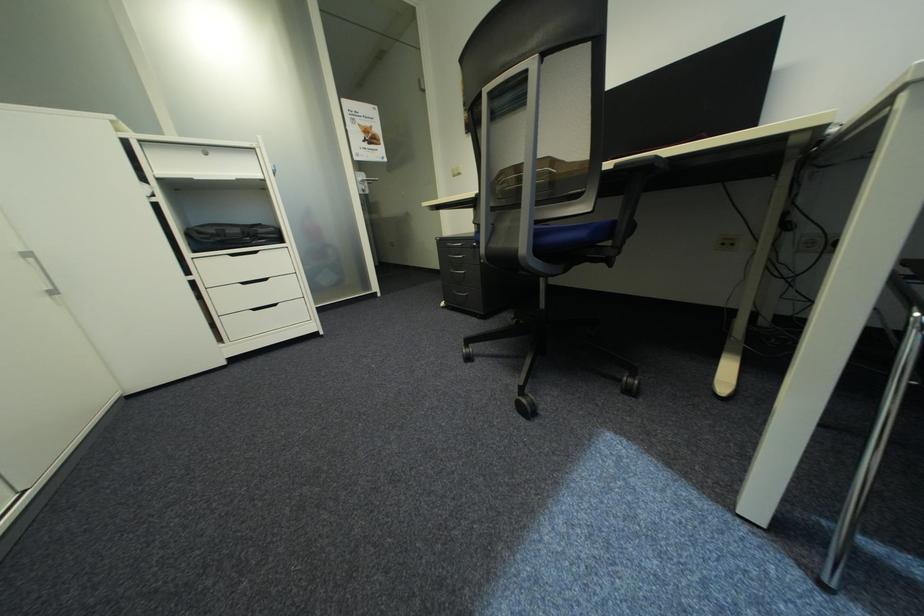
Where is `white cabinet handle`? This screenshot has width=924, height=616. white cabinet handle is located at coordinates (242, 253).